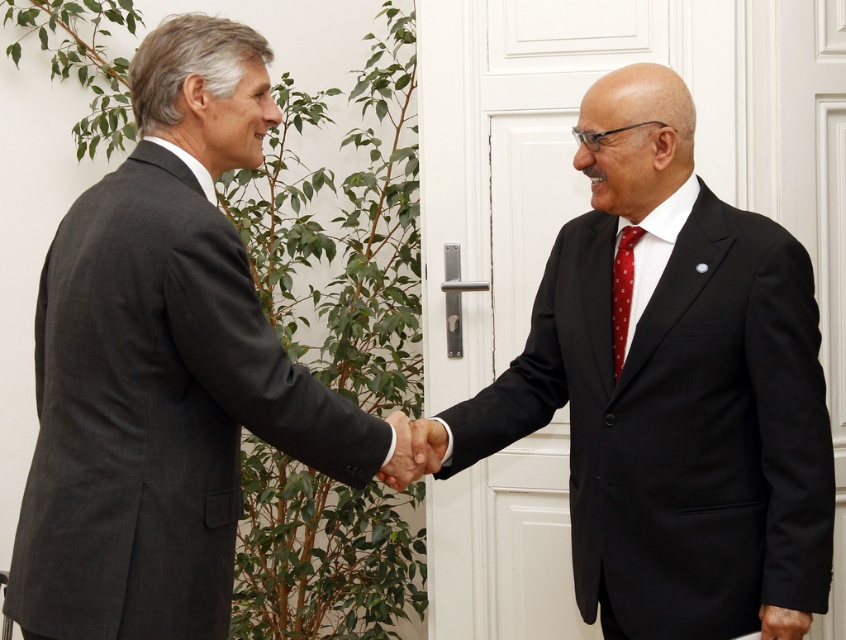
Can you confirm if black matte suit at center is bigger than red dotted tie at right?

Yes.

The image size is (846, 640). I want to click on black matte suit at center, so click(673, 387).

Where is `black matte suit at center`? Image resolution: width=846 pixels, height=640 pixels. black matte suit at center is located at coordinates (673, 387).

Does black smooth hand at center appear over black leather hand at lower right?

Yes.

Is black smooth hand at center smaller than black leather hand at lower right?

Incorrect, black smooth hand at center is not smaller in size than black leather hand at lower right.

Does point (415, 442) come behind point (803, 621)?

Yes, it is.

Where is `black smooth hand at center`? black smooth hand at center is located at coordinates (411, 451).

Is black matte suit at center positioned behind black smooth hand at center?

No, black matte suit at center is in front of black smooth hand at center.

Who is more distant from viewer, (764, 451) or (423, 436)?

Positioned behind is point (423, 436).

You are a GUI agent. You are given a task and a screenshot of the screen. Output one action in this format:
    pyautogui.click(x=<x>, y=<y>)
    Task: Click on the black matte suit at center
    Image resolution: width=846 pixels, height=640 pixels.
    Given the screenshot: What is the action you would take?
    pyautogui.click(x=673, y=387)